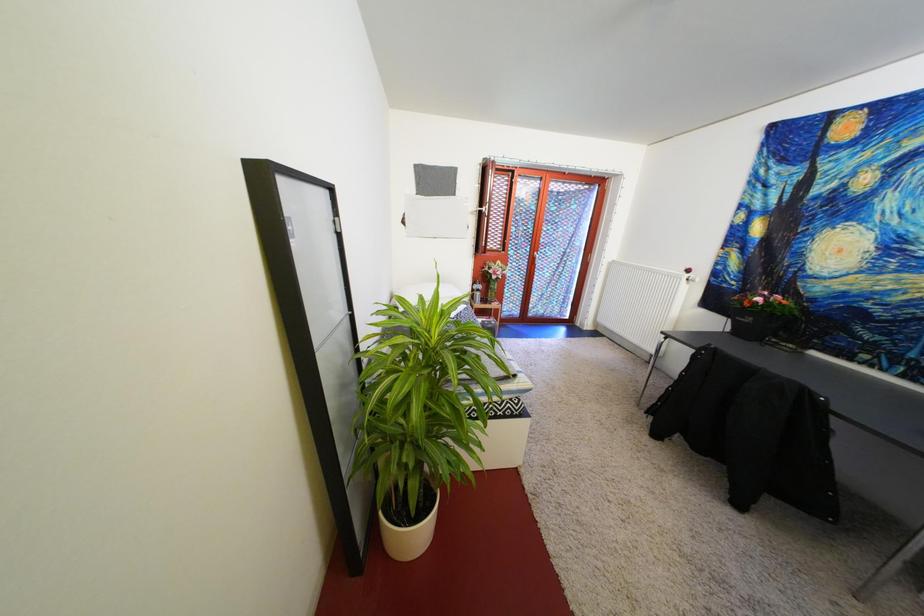
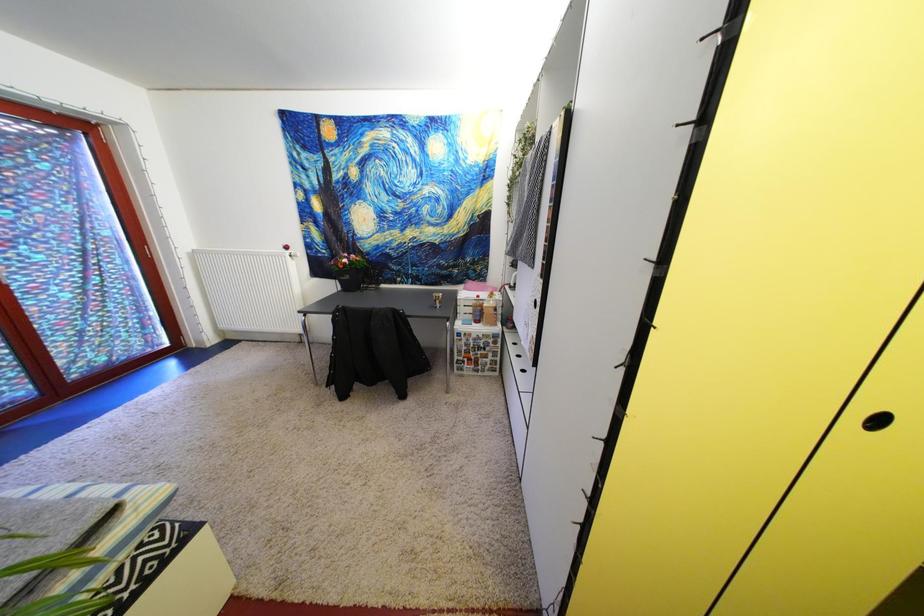
The images are taken continuously from a first-person perspective. In which direction is your viewpoint rotating?

The camera rotated toward right-down.